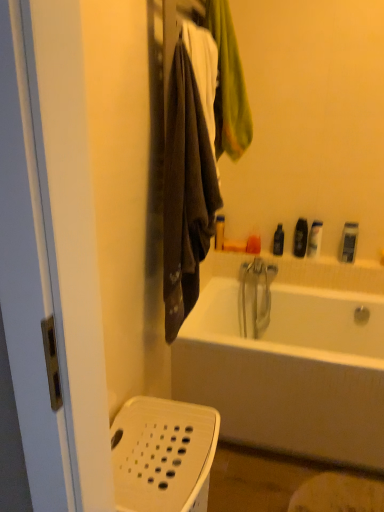
Question: Is point (279, 244) positioned closer to the camera than point (215, 245)?

Choices:
 (A) farther
 (B) closer

Answer: (B)

Question: In the image, is black plastic bottle at upper right, the 3th toiletry in the left-to-right sequence, on the left side or the right side of matte plastic soap at upper center, positioned as the first toiletry in left-to-right order?

Choices:
 (A) right
 (B) left

Answer: (A)

Question: Which object is positioned farthest from the orange matte soap at upper center, the 2th toiletry positioned from the left?

Choices:
 (A) white perforated basket at lower left
 (B) black plastic bottle at upper right, the 3th toiletry in the left-to-right sequence
 (C) matte plastic soap at upper center, positioned as the first toiletry in left-to-right order
 (D) black plastic bottle at upper right, which is counted as the third toiletry, starting from the right
 (E) dark brown fabric towel at left

Answer: (A)

Question: Considering the real-world distances, which object is farthest from the white perforated basket at lower left?

Choices:
 (A) orange matte soap at upper center, marked as the 5th toiletry in a right-to-left arrangement
 (B) translucent plastic bottle at upper right, the fifth toiletry in the left-to-right sequence
 (C) black plastic bottle at upper right, marked as the fourth toiletry in a left-to-right arrangement
 (D) white plastic razor at upper right, the 6th toiletry when ordered from left to right
 (E) dark brown fabric towel at left

Answer: (D)